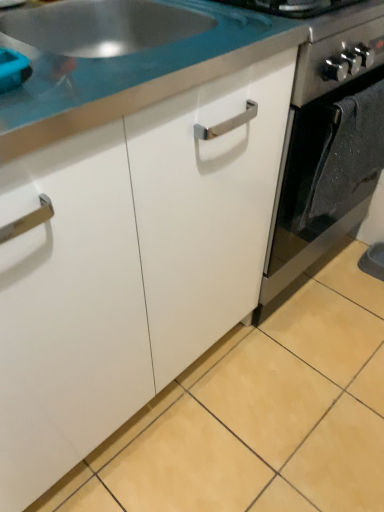
Question: In the image, is satin black oven at center on the left side or the right side of white glossy countertop at upper center?

Choices:
 (A) left
 (B) right

Answer: (B)

Question: In terms of width, does satin black oven at center look wider or thinner when compared to white glossy countertop at upper center?

Choices:
 (A) wide
 (B) thin

Answer: (A)

Question: In terms of height, does satin black oven at center look taller or shorter compared to white glossy countertop at upper center?

Choices:
 (A) short
 (B) tall

Answer: (B)

Question: Based on their positions, is white glossy countertop at upper center located to the left or right of satin black oven at center?

Choices:
 (A) right
 (B) left

Answer: (B)

Question: From a real-world perspective, is white glossy countertop at upper center physically located above or below satin black oven at center?

Choices:
 (A) above
 (B) below

Answer: (A)

Question: Looking at their shapes, would you say white glossy countertop at upper center is wider or thinner than satin black oven at center?

Choices:
 (A) thin
 (B) wide

Answer: (A)

Question: Considering their positions, is white glossy countertop at upper center located in front of or behind satin black oven at center?

Choices:
 (A) behind
 (B) front

Answer: (B)